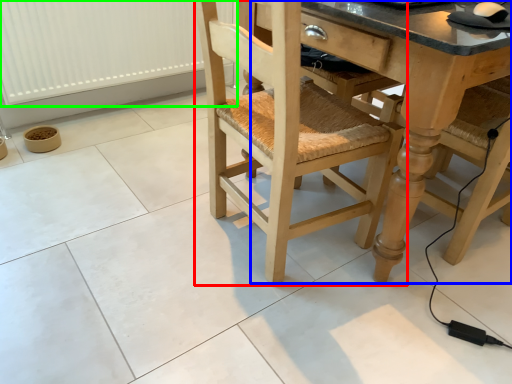
Question: Based on their relative distances, which object is nearer to chair (highlighted by a red box)? Choose from counter top (highlighted by a blue box) and radiator (highlighted by a green box).

Choices:
 (A) counter top
 (B) radiator

Answer: (A)